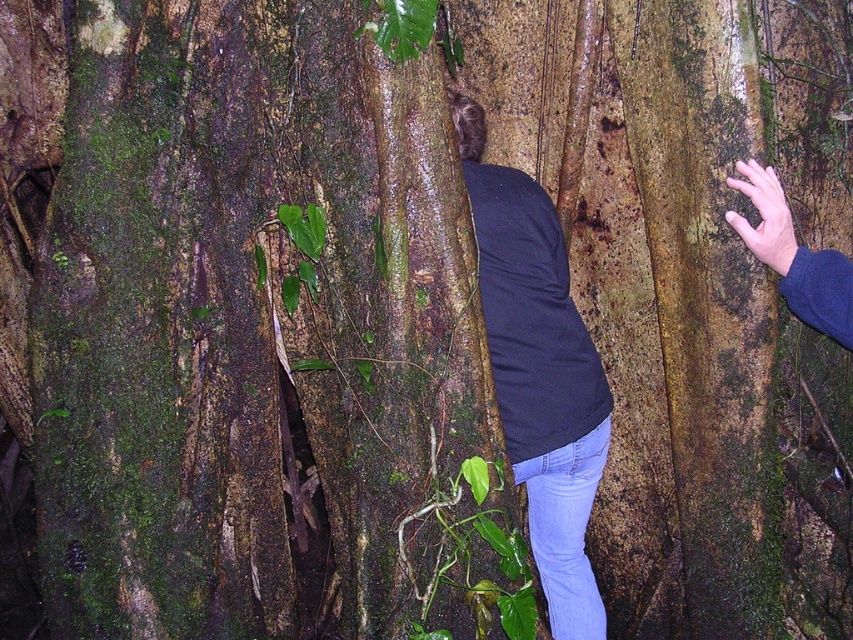
You are an observer in the forest scene. You notice the dark blue shirt at center and the blue fabric hand at right. Which object takes up more space in the image?

The dark blue shirt at center takes up more space in the image as it has a larger size compared to the blue fabric hand at right.

You are navigating through a dense forest and see two points marked on your map. The first point is at coordinate point (459, 116) and the second point is at coordinate point (790, 300). According to the scene, which point is closer to you?

Point (459, 116) is behind point (790, 300), so the point closer to you is point (790, 300).